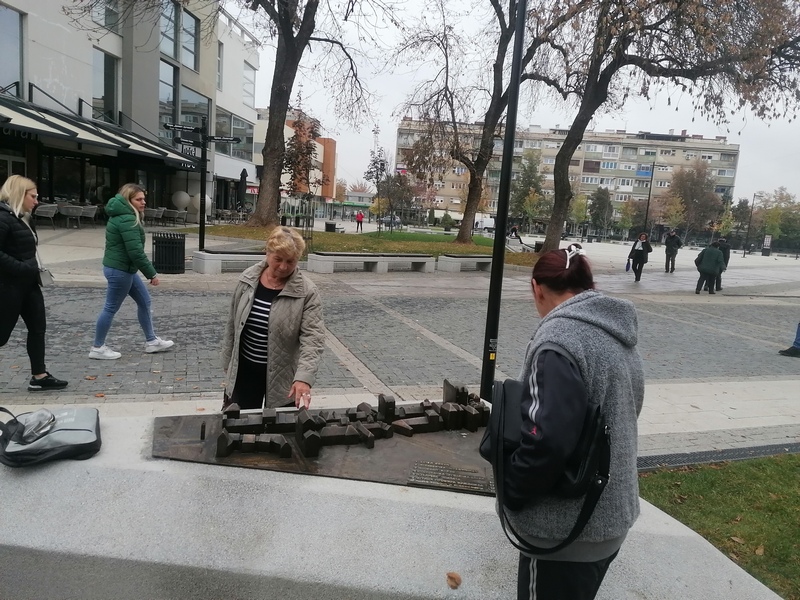
In order to click on sculpture in this screenshot , I will do `click(212, 420)`.